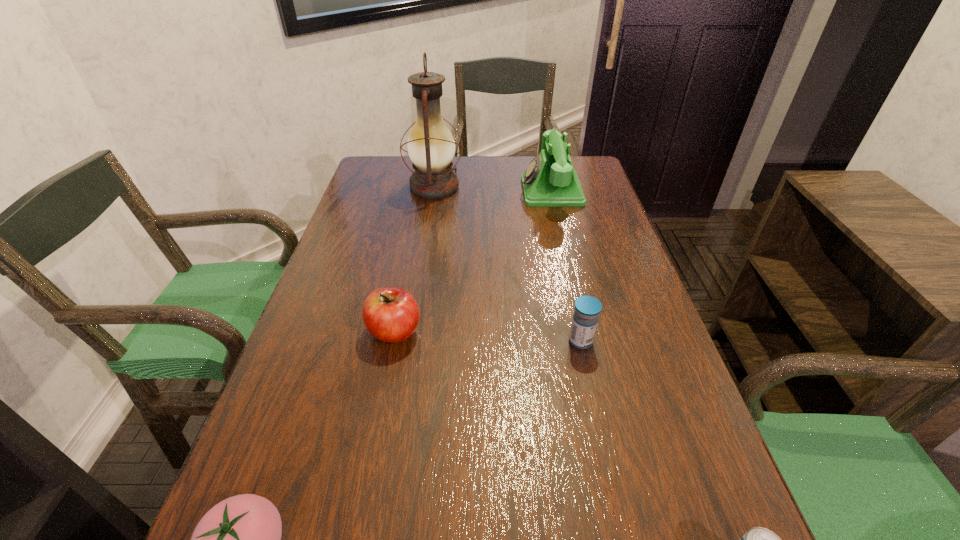
The width and height of the screenshot is (960, 540). Identify the location of the tallest object. click(431, 147).

Locate an element on the screen. telephone is located at coordinates (550, 180).

Where is `apple`? The image size is (960, 540). apple is located at coordinates (391, 314).

This screenshot has height=540, width=960. In order to click on medicine in this screenshot , I will do tap(587, 308).

In order to click on vacant space located on the right of the oil lamp in this screenshot , I will do `click(592, 187)`.

The image size is (960, 540). What are the coordinates of `vacant area situated on the dial of the telephone` in the screenshot? It's located at pos(451,191).

Locate an element on the screen. The width and height of the screenshot is (960, 540). vacant space located 0.290m on the dial of the telephone is located at coordinates (428, 191).

This screenshot has width=960, height=540. I want to click on free space located on the dial of the telephone, so click(x=480, y=191).

This screenshot has width=960, height=540. Identify the location of free location located 0.230m on the back of the apple. (411, 249).

This screenshot has height=540, width=960. What are the coordinates of `vacant space situated on the right of the medicine` in the screenshot? It's located at 656,341.